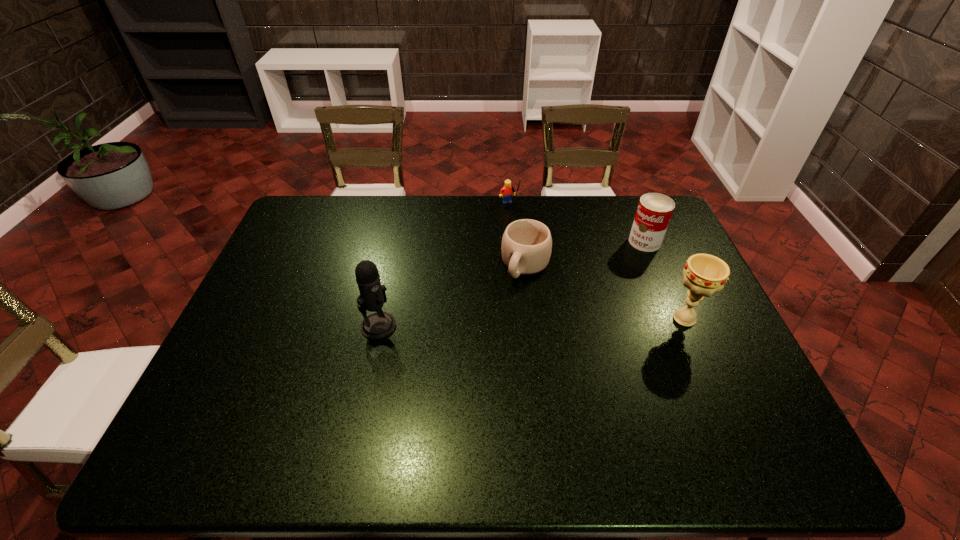
This screenshot has width=960, height=540. In order to click on the tallest object in this screenshot , I will do `click(378, 325)`.

This screenshot has width=960, height=540. I want to click on the leftmost object, so click(x=378, y=325).

Locate an element on the screen. This screenshot has height=540, width=960. the second tallest object is located at coordinates (704, 274).

Identify the location of can. (654, 211).

Find the location of a particular element. This screenshot has width=960, height=540. mug is located at coordinates (526, 247).

You are a GUI agent. You are given a task and a screenshot of the screen. Output one action in this format:
    pyautogui.click(x=<x>, y=<y>)
    Task: Click on the farthest object
    Image resolution: width=960 pixels, height=540 pixels.
    Given the screenshot: What is the action you would take?
    pyautogui.click(x=506, y=192)

Find the location of a particular element. This screenshot has height=540, width=960. vacant space located on the left of the microphone is located at coordinates (339, 326).

The height and width of the screenshot is (540, 960). Find the location of `vacant space located 0.350m on the left of the second tallest object`. vacant space located 0.350m on the left of the second tallest object is located at coordinates (540, 319).

In order to click on blank space located on the front label of the third shortest object in this screenshot , I will do `click(589, 273)`.

This screenshot has width=960, height=540. I want to click on free space located 0.060m on the front label of the third shortest object, so click(x=622, y=254).